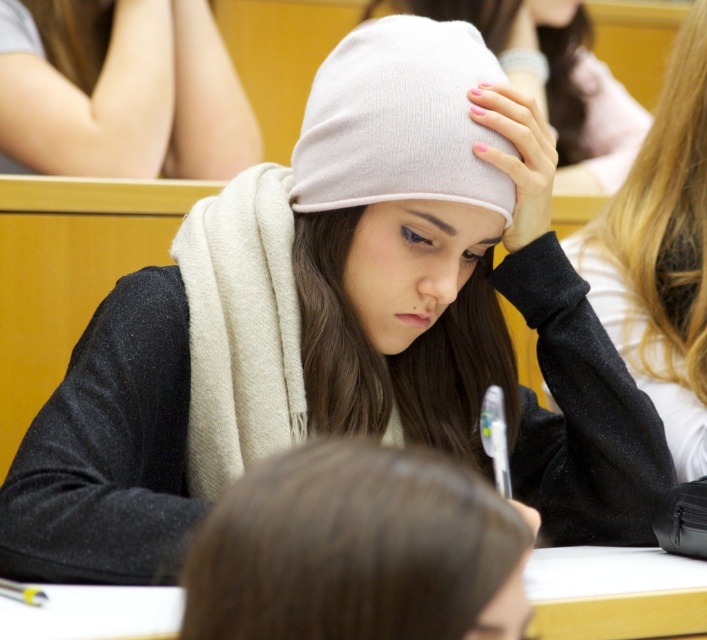
Question: Which object is positioned closest to the white knit beanie at upper center?

Choices:
 (A) brown matte hair at center
 (B) white knit cap at center

Answer: (B)

Question: Which point is closer to the camera taking this photo?

Choices:
 (A) (477, 212)
 (B) (95, 173)

Answer: (A)

Question: Does brown matte hair at center appear on the left side of white knit beanie at upper center?

Choices:
 (A) yes
 (B) no

Answer: (A)

Question: Is brown matte hair at center above white knit beanie at upper center?

Choices:
 (A) yes
 (B) no

Answer: (B)

Question: Which of the following is the closest to the observer?

Choices:
 (A) (472, 237)
 (B) (93, 42)
 (C) (467, 563)

Answer: (C)

Question: Can you confirm if brown matte hair at center is positioned above smooth beige scarf at upper left?

Choices:
 (A) yes
 (B) no

Answer: (B)